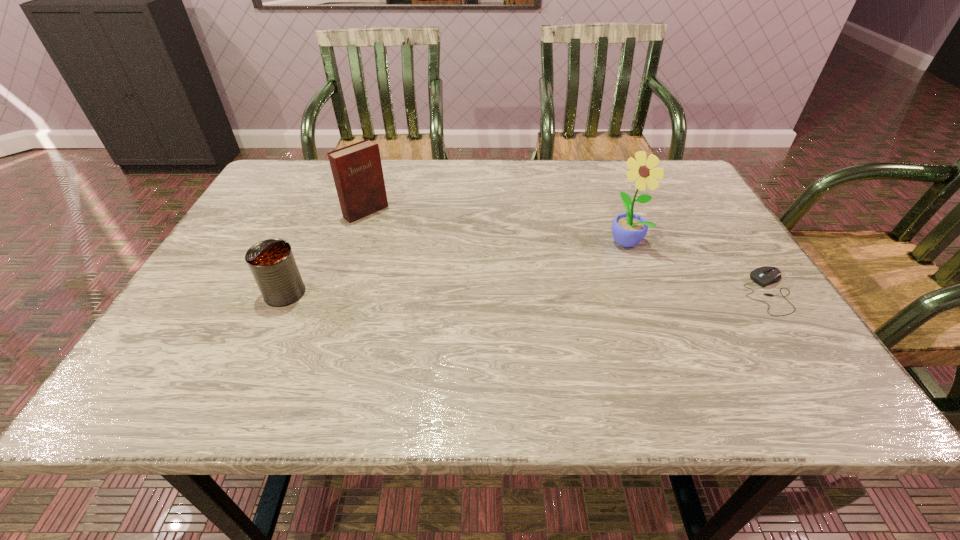
The height and width of the screenshot is (540, 960). Identify the location of the leftmost object. (272, 263).

Where is `can`? The height and width of the screenshot is (540, 960). can is located at coordinates (272, 263).

Identify the location of the rightmost object. This screenshot has height=540, width=960. (763, 276).

This screenshot has height=540, width=960. Identify the location of the shortest object. (763, 276).

Where is `the second farthest object`? The height and width of the screenshot is (540, 960). the second farthest object is located at coordinates (628, 229).

You are a GUI agent. You are given a task and a screenshot of the screen. Output one action in this format:
    pyautogui.click(x=<x>, y=<y>)
    Task: Click on the second object from right to left
    The image size is (960, 540).
    Given the screenshot: What is the action you would take?
    pyautogui.click(x=628, y=229)

Find the location of a particular element. This screenshot has width=960, height=540. the third object from right to left is located at coordinates (357, 171).

Image resolution: width=960 pixels, height=540 pixels. Identify the location of the farthest object. (357, 171).

The height and width of the screenshot is (540, 960). Identify the location of vacant region located on the back of the second shortest object. (308, 242).

Where is `free space located on the left of the shortest object`? free space located on the left of the shortest object is located at coordinates (608, 293).